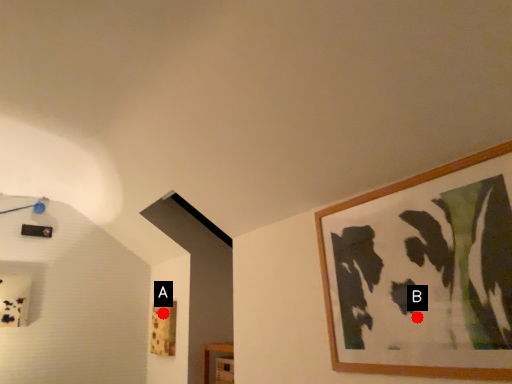
Question: Two points are circled on the image, labeled by A and B beside each circle. Among these points, which one is farthest from the camera?

Choices:
 (A) A is further
 (B) B is further

Answer: (A)